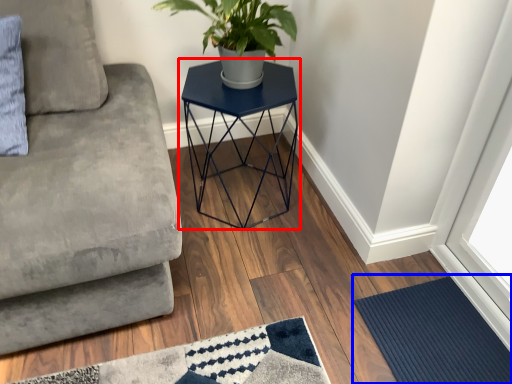
Question: Which object appears farthest to the camera in this image, table (highlighted by a red box) or doormat (highlighted by a blue box)?

Choices:
 (A) table
 (B) doormat

Answer: (A)